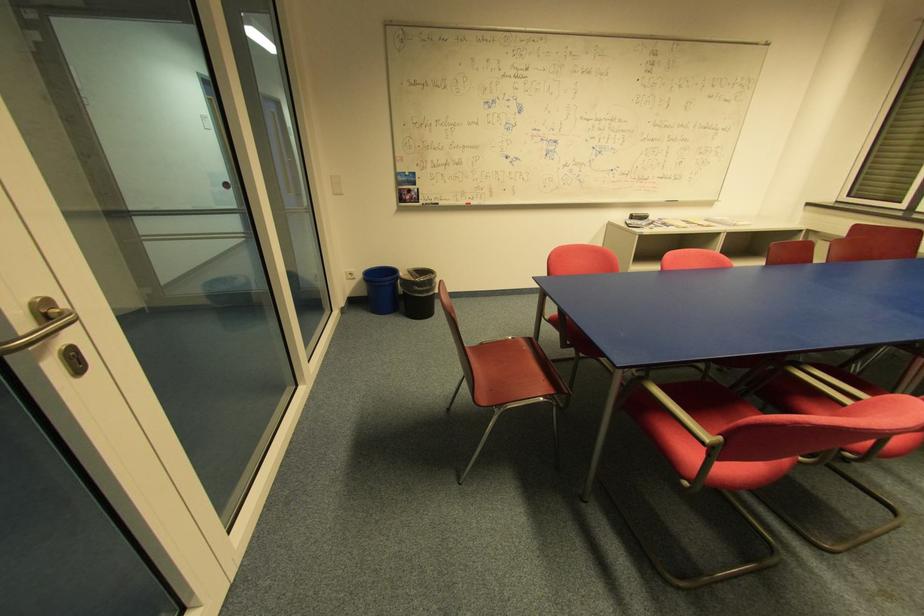
What are the coordinates of `door keyhole` in the screenshot? It's located at (73, 360).